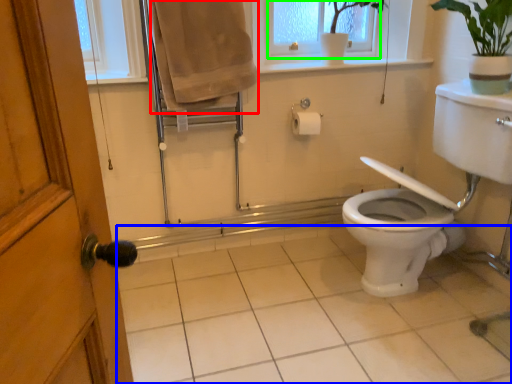
Question: Estimate the real-world distances between objects in this image. Which object is farther from bath towel (highlighted by a red box), plain (highlighted by a blue box) or window frame (highlighted by a green box)?

Choices:
 (A) plain
 (B) window frame

Answer: (A)